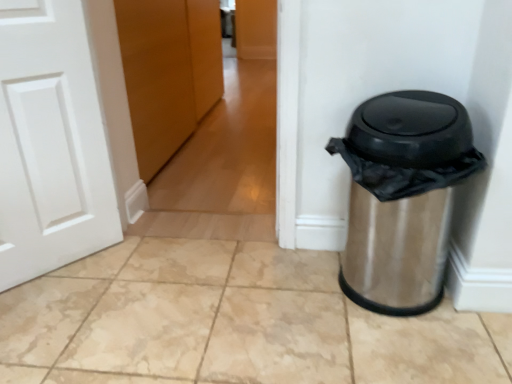
The width and height of the screenshot is (512, 384). I want to click on wooden door at center, so click(x=168, y=72).

What do you see at coordinates (168, 72) in the screenshot? Image resolution: width=512 pixels, height=384 pixels. I see `wooden door at center` at bounding box center [168, 72].

Describe the element at coordinates (402, 197) in the screenshot. I see `stainless steel trash can at right` at that location.

At what (x,y) coordinates should I click in order to perform the action: click on stainless steel trash can at right. Please return your answer as a coordinate pair (x, y). The height and width of the screenshot is (384, 512). Looking at the image, I should click on (402, 197).

Identify the location of wooden door at center. (168, 72).

Which is more to the left, wooden door at center or stainless steel trash can at right?

wooden door at center is more to the left.

Is wooden door at center in front of stainless steel trash can at right?

That is False.

Which is in front, point (141, 49) or point (397, 92)?

Point (397, 92)

From the image's perspective, is wooden door at center located above stainless steel trash can at right?

Yes, from the image's perspective, wooden door at center is over stainless steel trash can at right.

From a real-world perspective, who is located lower, wooden door at center or stainless steel trash can at right?

stainless steel trash can at right is physically lower.

Is wooden door at center wider or thinner than stainless steel trash can at right?

Considering their sizes, wooden door at center looks slimmer than stainless steel trash can at right.

Can you confirm if wooden door at center is taller than stainless steel trash can at right?

Indeed, wooden door at center has a greater height compared to stainless steel trash can at right.

Can you confirm if wooden door at center is smaller than stainless steel trash can at right?

Incorrect, wooden door at center is not smaller in size than stainless steel trash can at right.

Would you say wooden door at center contains stainless steel trash can at right?

That's incorrect, stainless steel trash can at right is not inside wooden door at center.

Is wooden door at center not close to stainless steel trash can at right?

Indeed, wooden door at center is not near stainless steel trash can at right.

Is wooden door at center looking in the opposite direction of stainless steel trash can at right?

No, wooden door at center's orientation is not away from stainless steel trash can at right.

Image resolution: width=512 pixels, height=384 pixels. In order to click on door above the stainless steel trash can at right (from the image's perspective) in this screenshot , I will do `click(168, 72)`.

Would you say stainless steel trash can at right is to the left or to the right of wooden door at center in the picture?

Clearly, stainless steel trash can at right is on the right of wooden door at center in the image.

Which object is closer to the camera taking this photo, stainless steel trash can at right or wooden door at center?

stainless steel trash can at right is more forward.

Does point (418, 108) come closer to viewer compared to point (132, 21)?

Yes, it is.

From the image's perspective, which is above, stainless steel trash can at right or wooden door at center?

wooden door at center appears higher in the image.

Based on the photo, from a real-world perspective, is stainless steel trash can at right beneath wooden door at center?

Indeed, from a real-world perspective, stainless steel trash can at right is positioned beneath wooden door at center.

Looking at this image, is stainless steel trash can at right wider or thinner than wooden door at center?

Clearly, stainless steel trash can at right has more width compared to wooden door at center.

Between stainless steel trash can at right and wooden door at center, which one has less height?

stainless steel trash can at right.

Considering the sizes of objects stainless steel trash can at right and wooden door at center in the image provided, who is bigger, stainless steel trash can at right or wooden door at center?

Bigger between the two is wooden door at center.

Is stainless steel trash can at right positioned beyond the bounds of wooden door at center?

Indeed, stainless steel trash can at right is completely outside wooden door at center.

Is stainless steel trash can at right far from wooden door at center?

stainless steel trash can at right is positioned a significant distance from wooden door at center.

Is stainless steel trash can at right turned away from wooden door at center?

No, stainless steel trash can at right is not facing away from wooden door at center.

How different are the orientations of stainless steel trash can at right and wooden door at center in degrees?

stainless steel trash can at right and wooden door at center are facing 90.4 degrees away from each other.

Identify the location of door behind the stainless steel trash can at right. (168, 72).

This screenshot has height=384, width=512. Find the location of `door lying on the left of stainless steel trash can at right`. door lying on the left of stainless steel trash can at right is located at coordinates (168, 72).

You are a GUI agent. You are given a task and a screenshot of the screen. Output one action in this format:
    pyautogui.click(x=<x>, y=<y>)
    Task: Click on the door that is behind the stainless steel trash can at right
    
    Given the screenshot: What is the action you would take?
    pyautogui.click(x=168, y=72)